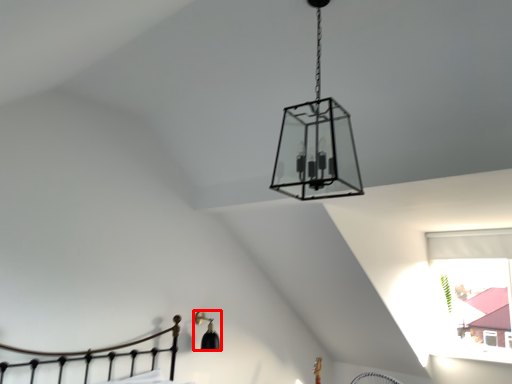
Question: Where is lamp (annotated by the red box) located in relation to lamp in the image?

Choices:
 (A) right
 (B) left

Answer: (B)